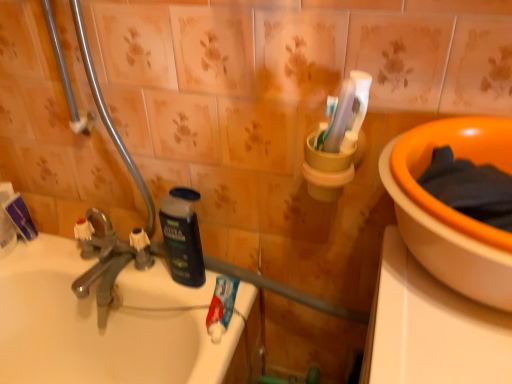
Question: From the image's perspective, relative to white matte toothpaste at upper left, which is the second toothpaste from bottom to top, is blue matte toothpaste at sink, which ranks as the first toothpaste in right-to-left order, above or below?

Choices:
 (A) above
 (B) below

Answer: (B)

Question: Is blue matte toothpaste at sink, the 1th toothpaste positioned from the bottom, to the left or to the right of white matte toothpaste at upper left, which is counted as the 2th toothpaste, starting from the right, in the image?

Choices:
 (A) right
 (B) left

Answer: (A)

Question: Estimate the real-world distances between objects in this image. Which object is farther from the white matte toothpaste at upper left, which is the second toothpaste from bottom to top?

Choices:
 (A) orange ceramic basin at upper right
 (B) black matte bottle at center
 (C) blue matte toothpaste at sink, the 2th toothpaste when ordered from back to front
 (D) chrome metallic faucet at left

Answer: (A)

Question: Considering the real-world distances, which object is farthest from the blue matte toothpaste at sink, which ranks as the first toothpaste in right-to-left order?

Choices:
 (A) chrome metallic faucet at left
 (B) white matte toothpaste at upper left, the 1th toothpaste viewed from the top
 (C) black matte bottle at center
 (D) orange ceramic basin at upper right

Answer: (B)